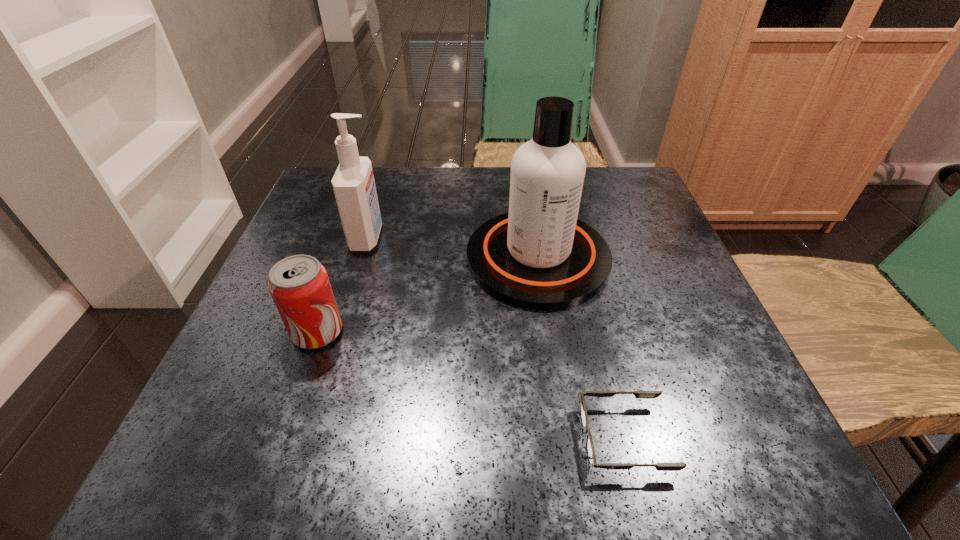
The image size is (960, 540). What are the coordinates of `vacant space located 0.310m on the temples of the shortest object` in the screenshot? It's located at (345, 438).

This screenshot has height=540, width=960. Find the location of `free space located on the temples of the shortest object`. free space located on the temples of the shortest object is located at coordinates (527, 438).

You are a GUI agent. You are given a task and a screenshot of the screen. Output one action in this format:
    pyautogui.click(x=<x>, y=<y>)
    Task: Click on the vacant space located 0.250m on the temples of the shortest object
    
    Given the screenshot: What is the action you would take?
    pyautogui.click(x=391, y=438)

You are a GUI agent. You are given a task and a screenshot of the screen. Output one action in this format:
    pyautogui.click(x=<x>, y=<y>)
    Task: Click on the object at the near edge
    The height and width of the screenshot is (540, 960).
    Given the screenshot: What is the action you would take?
    pyautogui.click(x=590, y=451)

The width and height of the screenshot is (960, 540). What are the coordinates of `cleansing agent situated at the left edge` in the screenshot? It's located at (353, 183).

The width and height of the screenshot is (960, 540). I want to click on soda can present at the left edge, so click(x=299, y=285).

This screenshot has height=540, width=960. I want to click on cleansing agent that is at the right edge, so click(x=539, y=256).

Locate an element on the screen. The width and height of the screenshot is (960, 540). sunglasses present at the right edge is located at coordinates (590, 451).

In order to click on object present at the far left corner in this screenshot , I will do `click(353, 183)`.

At what (x,y) coordinates should I click in order to perform the action: click on object that is at the far right corner. Please return your answer as a coordinate pair (x, y). The height and width of the screenshot is (540, 960). Looking at the image, I should click on (539, 256).